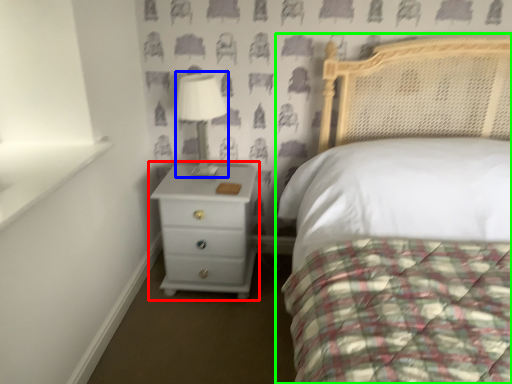
Question: Which is farther away from chest of drawers (highlighted by a red box)? table lamp (highlighted by a blue box) or bed (highlighted by a green box)?

Choices:
 (A) table lamp
 (B) bed

Answer: (B)